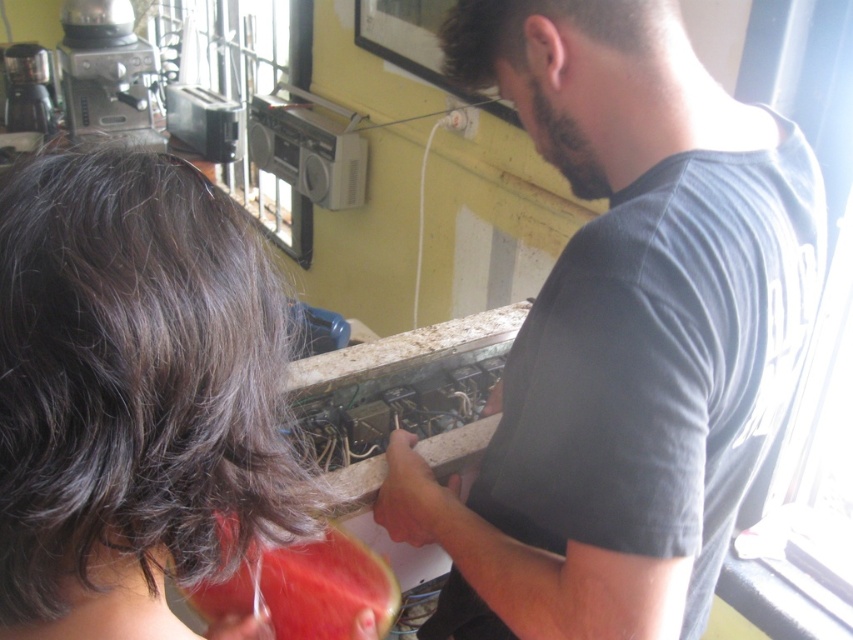
You are a photographer trying to capture a closeup of both the dark brown hair at upper left and the red matte watermelon at lower left in the scene. Given the camera lens you have can only focus on objects wider than 10 cm, will both subjects be in focus?

The dark brown hair at upper left is narrower than the red matte watermelon at lower left. Since the watermelon is wider, it might meet the 10 cm requirement, but the hair may be too narrow. However, the exact width of the hair isn

You are a delivery person who needs to place a large box on the countertop. The box is taller than the gray matte shirt at center. Can you safely place it on the countertop without it touching the red matte watermelon at lower left?

The gray matte shirt at center is much taller than the red matte watermelon at lower left. Since the box is taller than the gray matte shirt at center, it will definitely be taller than the red matte watermelon at lower left. However, the spatial relationship between the box and the watermelon depends on their positions. The red matte watermelon at lower left is located at the lower left, so if the box is placed away from that area, it might not touch it. But without knowing the exact dimensions and layout,